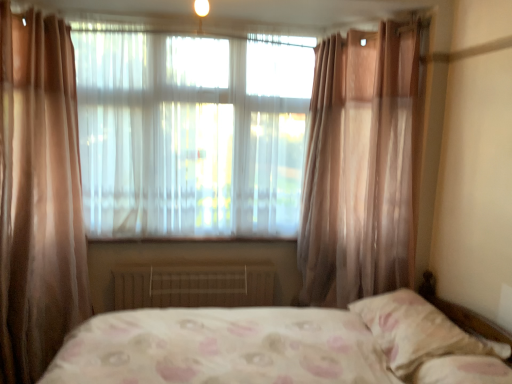
Question: Is metallic radiator at center at the left side of translucent fabric window at center?

Choices:
 (A) yes
 (B) no

Answer: (A)

Question: Considering the relative sizes of metallic radiator at center and translucent fabric window at center in the image provided, is metallic radiator at center taller than translucent fabric window at center?

Choices:
 (A) no
 (B) yes

Answer: (A)

Question: Does metallic radiator at center have a lesser width compared to translucent fabric window at center?

Choices:
 (A) yes
 (B) no

Answer: (A)

Question: Is metallic radiator at center next to translucent fabric window at center and touching it?

Choices:
 (A) yes
 (B) no

Answer: (B)

Question: From a real-world perspective, is metallic radiator at center positioned under translucent fabric window at center based on gravity?

Choices:
 (A) no
 (B) yes

Answer: (B)

Question: Based on their sizes in the image, would you say sheer pink curtain at right is bigger or smaller than metallic radiator at center?

Choices:
 (A) small
 (B) big

Answer: (B)

Question: In terms of height, does sheer pink curtain at right look taller or shorter compared to metallic radiator at center?

Choices:
 (A) tall
 (B) short

Answer: (A)

Question: From the image's perspective, relative to metallic radiator at center, is sheer pink curtain at right above or below?

Choices:
 (A) above
 (B) below

Answer: (A)

Question: From a real-world perspective, relative to metallic radiator at center, is sheer pink curtain at right vertically above or below?

Choices:
 (A) above
 (B) below

Answer: (A)

Question: Considering the positions of sheer pink curtain at right and matte white light at upper center in the image, is sheer pink curtain at right taller or shorter than matte white light at upper center?

Choices:
 (A) tall
 (B) short

Answer: (A)

Question: From the image's perspective, relative to matte white light at upper center, is sheer pink curtain at right above or below?

Choices:
 (A) above
 (B) below

Answer: (B)

Question: Does point (364, 71) appear closer or farther from the camera than point (195, 11)?

Choices:
 (A) closer
 (B) farther

Answer: (A)

Question: Visually, is sheer pink curtain at right positioned to the left or to the right of matte white light at upper center?

Choices:
 (A) right
 (B) left

Answer: (A)

Question: From a real-world perspective, is sheer pink curtain at right physically located above or below white floral fabric pillow at lower right?

Choices:
 (A) above
 (B) below

Answer: (A)

Question: Is sheer pink curtain at right wider or thinner than white floral fabric pillow at lower right?

Choices:
 (A) thin
 (B) wide

Answer: (B)